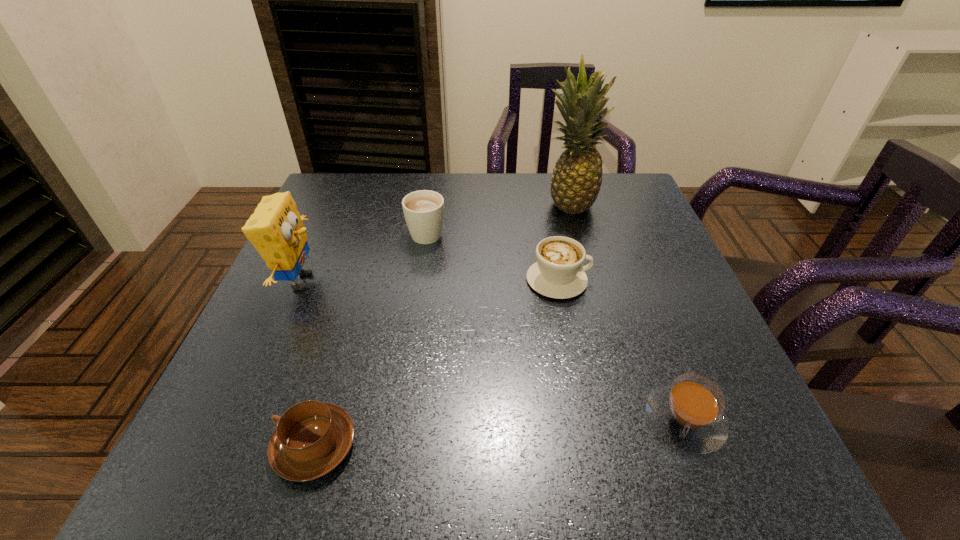
Find the location of a particular element. The height and width of the screenshot is (540, 960). empty space that is in between the tallest cappuccino and the fifth object from right to left is located at coordinates (371, 339).

I want to click on free space between the second object from left to right and the leftmost object, so click(308, 363).

At what (x,y) coordinates should I click in order to perform the action: click on empty location between the tallest cappuccino and the third nearest cappuccino. Please return your answer as a coordinate pair (x, y). Looking at the image, I should click on (492, 256).

Where is `vacant area that lies between the sponge and the fourth object from right to left`? The image size is (960, 540). vacant area that lies between the sponge and the fourth object from right to left is located at coordinates (364, 256).

Find the location of a particular element. The image size is (960, 540). free space that is in between the tallest object and the leftmost cappuccino is located at coordinates (442, 325).

At what (x,y) coordinates should I click in order to perform the action: click on unoccupied area between the third cappuccino from left to right and the leftmost cappuccino. Please return your answer as a coordinate pair (x, y). This screenshot has width=960, height=540. Looking at the image, I should click on (x=437, y=363).

Image resolution: width=960 pixels, height=540 pixels. I want to click on free space between the rightmost cappuccino and the pineapple, so click(x=626, y=312).

What are the coordinates of `free point between the farthest cappuccino and the pineapple` in the screenshot? It's located at (497, 218).

Point out which object is positioned as the fifth nearest to the third cappuccino from right to left. Please provide its 2D coordinates. Your answer should be formatted as a tuple, i.e. [(x, y)], where the tuple contains the x and y coordinates of a point satisfying the conditions above.

[(688, 413)]

Locate an element on the screen. The height and width of the screenshot is (540, 960). object that is the third closest to the fourth tallest object is located at coordinates (688, 413).